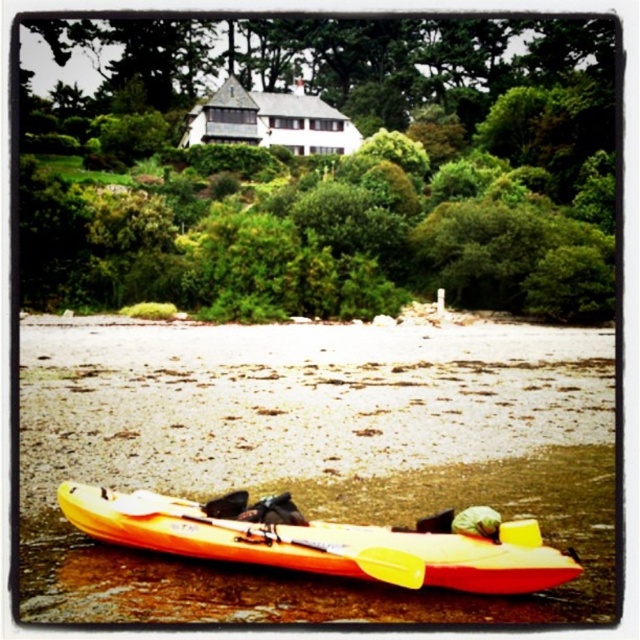
You are standing at the point labeled point (497, 83) in the image. You want to take a photo of the white house with dark shutters and gray roof on the hill. Is the white house with dark shutters and gray roof on the hill visible from your current position?

The point labeled point (497, 83) is 108.09 meters away from the camera. Since the white house with dark shutters and gray roof on the hill is partially obscured by foliage, it might not be fully visible from that distance and position.

From the picture: You are standing at the point closer to the camera in the image. Looking towards the point further away, which direction would you face? The points are point (300, 124) and point (134, 490).

The point further to the camera is point (300, 124), so if you are standing there and facing towards point (134, 490), you would be facing away from the white house on the hill. However, based on the coordinates, point (134, 490) is actually closer to the camera than point (300, 124). Therefore, the correct direction would depend on their actual positions in the scene.